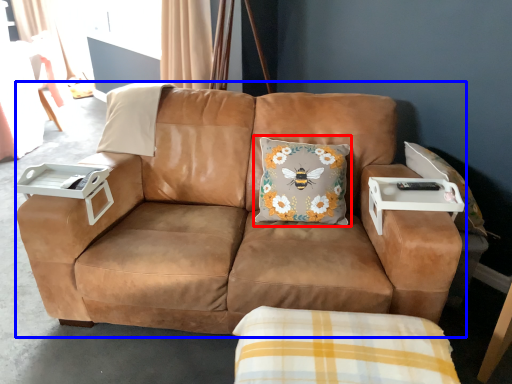
Question: Which point is closer to the camera, throw pillow (highlighted by a red box) or studio couch (highlighted by a blue box)?

Choices:
 (A) throw pillow
 (B) studio couch

Answer: (B)